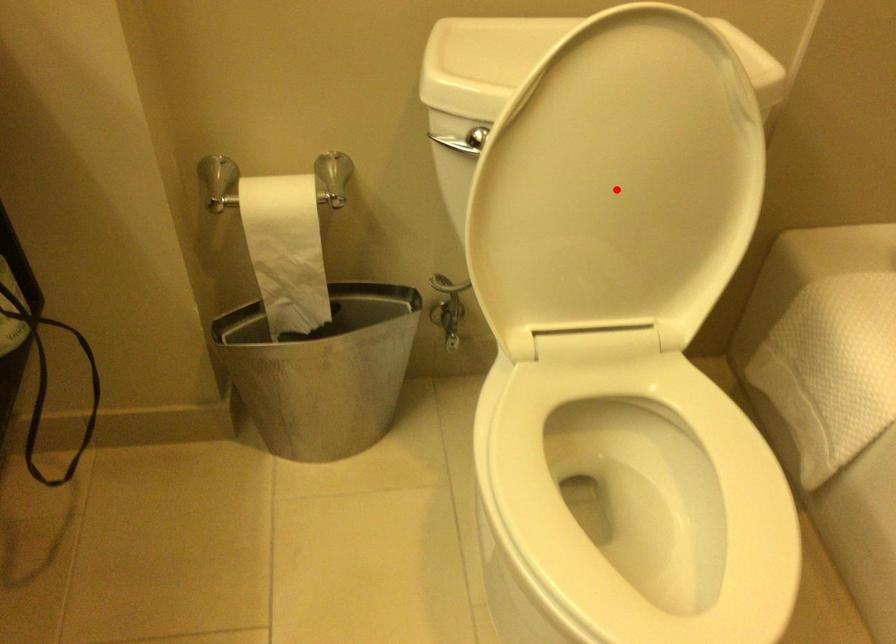
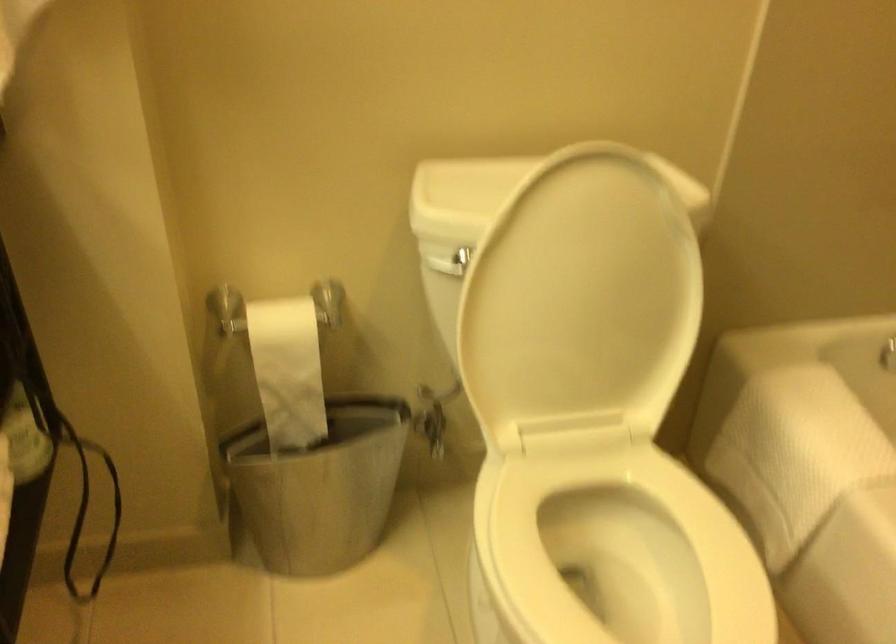
Question: I am providing you with two images of the same scene from different viewpoints. A red point is shown in image1. For the corresponding object point in image2, is it positioned nearer or farther from the camera?

Choices:
 (A) Nearer
 (B) Farther

Answer: (B)